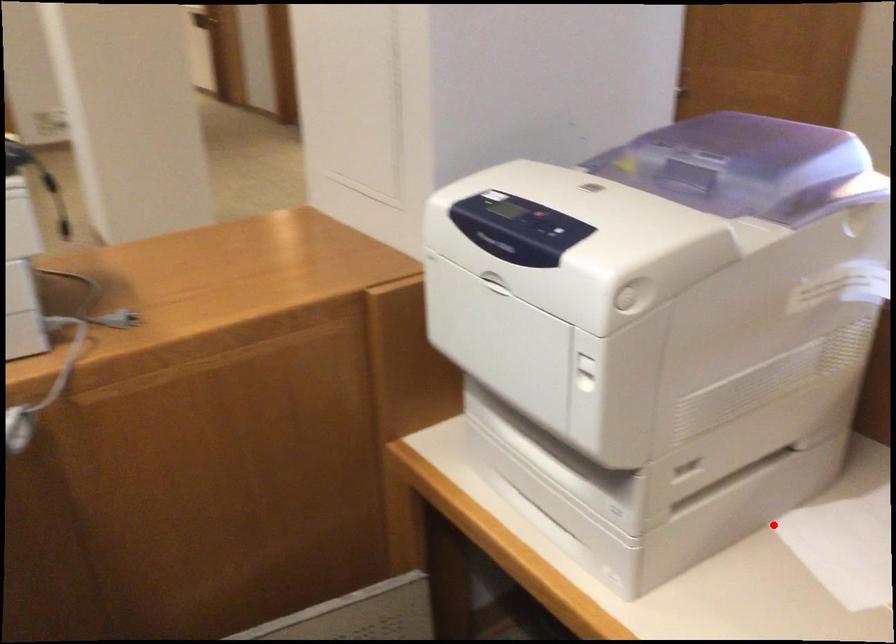
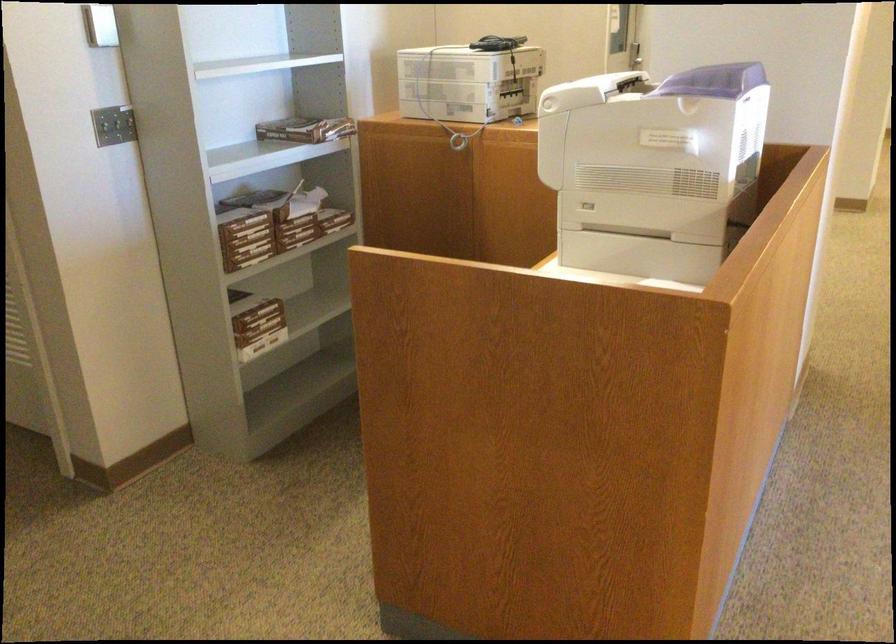
Question: I am providing you with two images of the same scene from different viewpoints. Given a red point in image1, look at the same physical point in image2. Is it:

Choices:
 (A) Closer to the viewpoint
 (B) Farther from the viewpoint

Answer: (B)